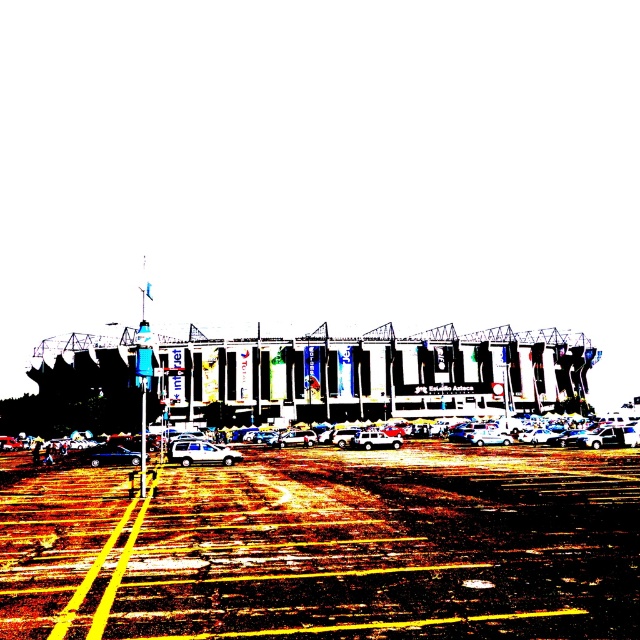
You are a photographer standing in front of the stadium. You want to capture a photo that includes both the brown asphalt parking lot at center and the white glossy car at center. Which object should you focus on first to ensure both are in frame?

The brown asphalt parking lot at center is much taller than the white glossy car at center, so you should focus on the taller brown asphalt parking lot at center first to ensure both are in frame.

You are a delivery driver who needs to park your truck in the brown asphalt parking lot at center. However, there is a metallic silver suv at center already occupying the space. Based on the scene description, can your truck fit into the parking spot if you try to park there?

The brown asphalt parking lot at center is positioned over the metallic silver suv at center, meaning the SUV is already occupying the parking spot. Therefore, your truck cannot fit into the parking spot as it is already taken by the SUV.